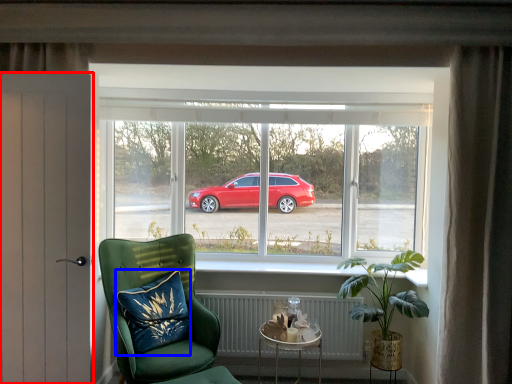
Question: Which object appears closest to the camera in this image, door (highlighted by a red box) or pillow (highlighted by a blue box)?

Choices:
 (A) door
 (B) pillow

Answer: (A)